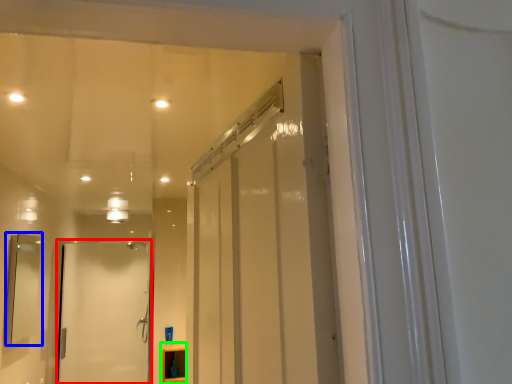
Question: Which object is the farthest from door (highlighted by a red box)? Choose among these: mirror (highlighted by a blue box) or cabinetry (highlighted by a green box).

Choices:
 (A) mirror
 (B) cabinetry

Answer: (A)